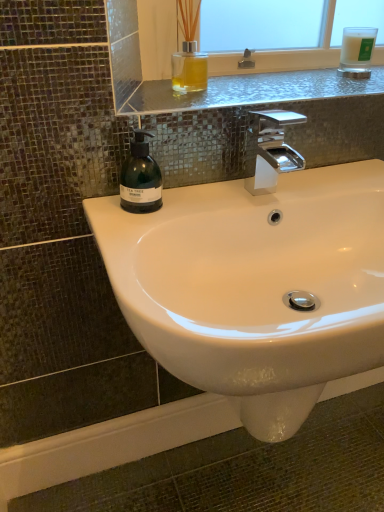
In order to click on free space that is in between green matte soap dispenser at left and polished chrome faucet at center in this screenshot , I will do `click(209, 201)`.